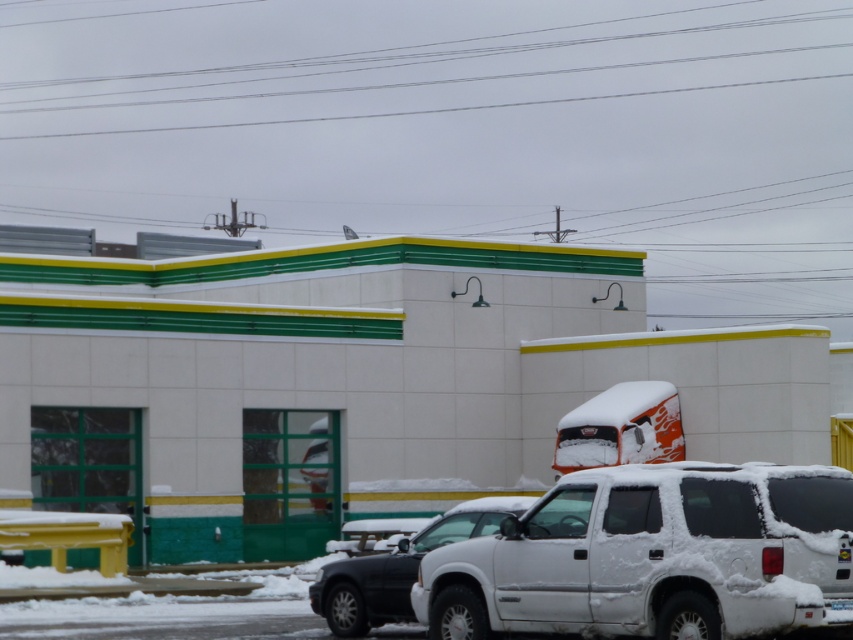
Question: Where is white matte suv at lower right located in relation to orange matte truck at center in the image?

Choices:
 (A) below
 (B) above

Answer: (A)

Question: Which object appears closest to the camera in this image?

Choices:
 (A) orange matte truck at center
 (B) white matte suv at lower right
 (C) white matte suv at lower center

Answer: (B)

Question: Which is nearer to the orange matte truck at center?

Choices:
 (A) white matte suv at lower right
 (B) white matte suv at lower center

Answer: (B)

Question: Does white matte suv at lower right appear on the left side of orange matte truck at center?

Choices:
 (A) yes
 (B) no

Answer: (A)

Question: Which object is the farthest from the white matte suv at lower center?

Choices:
 (A) orange matte truck at center
 (B) white matte suv at lower right

Answer: (A)

Question: Does white matte suv at lower right appear over orange matte truck at center?

Choices:
 (A) no
 (B) yes

Answer: (A)